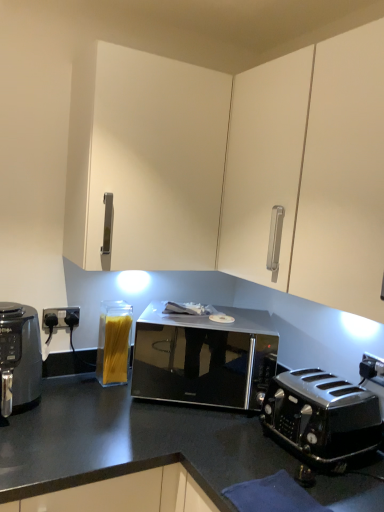
Measure the distance between polished black toaster at lower right and camera.

polished black toaster at lower right is 3.95 feet from camera.

The width and height of the screenshot is (384, 512). What are the coordinates of `black glossy microwave at center` in the screenshot? It's located at (204, 358).

This screenshot has height=512, width=384. What do you see at coordinates (19, 357) in the screenshot?
I see `black matte air fryer at left` at bounding box center [19, 357].

Where is `white matte cabinet at upper center`? This screenshot has width=384, height=512. white matte cabinet at upper center is located at coordinates (145, 160).

The height and width of the screenshot is (512, 384). What do you see at coordinates (114, 342) in the screenshot?
I see `clear glass container of spaghetti at lower left` at bounding box center [114, 342].

The width and height of the screenshot is (384, 512). Find the location of `polished black toaster at lower right`. polished black toaster at lower right is located at coordinates (322, 417).

How many degrees apart are the facing directions of black glossy microwave at center and black plastic electrical outlet at lower right?

56.8 degrees separate the facing orientations of black glossy microwave at center and black plastic electrical outlet at lower right.

From a real-world perspective, does black glossy microwave at center stand above black plastic electrical outlet at lower right?

Incorrect, from a real-world perspective, black glossy microwave at center is lower than black plastic electrical outlet at lower right.

From the image's perspective, is black glossy microwave at center on black plastic electrical outlet at lower right?

No.

Is black matte air fryer at left located outside black glossy microwave at center?

Yes, black matte air fryer at left is not within black glossy microwave at center.

Is point (31, 364) positioned behind point (154, 348)?

That is False.

Locate an element on the screen. microwave oven on the right of black matte air fryer at left is located at coordinates (204, 358).

From the picture: From the image's perspective, which is above, black matte air fryer at left or black glossy microwave at center?

black matte air fryer at left appears higher in the image.

Is polished black toaster at lower right taller than clear glass container of spaghetti at lower left?

In fact, polished black toaster at lower right may be shorter than clear glass container of spaghetti at lower left.

From the image's perspective, is polished black toaster at lower right located above clear glass container of spaghetti at lower left?

Actually, polished black toaster at lower right appears below clear glass container of spaghetti at lower left in the image.

Can you confirm if polished black toaster at lower right is bigger than clear glass container of spaghetti at lower left?

Indeed, polished black toaster at lower right has a larger size compared to clear glass container of spaghetti at lower left.

Is polished black toaster at lower right oriented away from clear glass container of spaghetti at lower left?

No, polished black toaster at lower right's orientation is not away from clear glass container of spaghetti at lower left.

Would you say clear glass container of spaghetti at lower left is inside or outside black glossy microwave at center?

The correct answer is: outside.

What's the angular difference between clear glass container of spaghetti at lower left and black glossy microwave at center's facing directions?

The facing directions of clear glass container of spaghetti at lower left and black glossy microwave at center are 24.8 degrees apart.

Does clear glass container of spaghetti at lower left have a larger size compared to black glossy microwave at center?

Incorrect, clear glass container of spaghetti at lower left is not larger than black glossy microwave at center.

Where is `microwave oven on the right of the clear glass container of spaghetti at lower left`? The image size is (384, 512). microwave oven on the right of the clear glass container of spaghetti at lower left is located at coordinates (204, 358).

Is polished black toaster at lower right to the left or to the right of black plastic electrical outlet at lower right in the image?

In the image, polished black toaster at lower right appears on the left side of black plastic electrical outlet at lower right.

From the image's perspective, which one is positioned higher, polished black toaster at lower right or black plastic electrical outlet at lower right?

black plastic electrical outlet at lower right appears higher in the image.

Is polished black toaster at lower right oriented away from black plastic electrical outlet at lower right?

No.

Considering the sizes of objects polished black toaster at lower right and black plastic electrical outlet at lower right in the image provided, who is smaller, polished black toaster at lower right or black plastic electrical outlet at lower right?

With smaller size is black plastic electrical outlet at lower right.

Does point (114, 334) appear closer or farther from the camera than point (275, 392)?

Point (114, 334) is farther from the camera than point (275, 392).

Could you tell me if clear glass container of spaghetti at lower left is turned towards polished black toaster at lower right?

No, clear glass container of spaghetti at lower left is not oriented towards polished black toaster at lower right.

How much distance is there between clear glass container of spaghetti at lower left and polished black toaster at lower right?

The distance of clear glass container of spaghetti at lower left from polished black toaster at lower right is 28.07 inches.

From the picture: Which of these two, clear glass container of spaghetti at lower left or polished black toaster at lower right, stands taller?

Standing taller between the two is clear glass container of spaghetti at lower left.

Is black glossy microwave at center outside of white matte cabinet at upper center?

black glossy microwave at center lies outside white matte cabinet at upper center's area.

Which object is closer to the camera, black glossy microwave at center or white matte cabinet at upper center?

white matte cabinet at upper center is more forward.

Identify the location of cabinetry that is above the black glossy microwave at center (from a real-world perspective). (145, 160).

Can you tell me how much black glossy microwave at center and white matte cabinet at upper center differ in facing direction?

They differ by 34 degrees in their facing directions.

Find the location of a particular element. electric outlet located in front of the black glossy microwave at center is located at coordinates (372, 368).

Locate an element on the screen. microwave oven that is behind the black matte air fryer at left is located at coordinates (204, 358).

Which object lies further to the anchor point black plastic electrical outlet at lower right, white matte cabinet at upper center or black glossy microwave at center?

white matte cabinet at upper center.

Considering their positions, is black glossy microwave at center positioned closer to black plastic electrical outlet at lower right than clear glass container of spaghetti at lower left?

black glossy microwave at center is positioned closer to the anchor black plastic electrical outlet at lower right.

From the image, which object appears to be nearer to polished black toaster at lower right, black plastic electrical outlet at lower right or clear glass container of spaghetti at lower left?

Among the two, black plastic electrical outlet at lower right is located nearer to polished black toaster at lower right.

From the image, which object appears to be farther from clear glass container of spaghetti at lower left, black matte air fryer at left or white matte cabinet at upper center?

The object further to clear glass container of spaghetti at lower left is white matte cabinet at upper center.

Based on their spatial positions, is clear glass container of spaghetti at lower left or black glossy microwave at center further from polished black toaster at lower right?

clear glass container of spaghetti at lower left is positioned further to the anchor polished black toaster at lower right.

From the image, which object appears to be nearer to polished black toaster at lower right, black matte air fryer at left or white matte cabinet at upper center?

white matte cabinet at upper center lies closer to polished black toaster at lower right than the other object.

Which object lies nearer to the anchor point black plastic electrical outlet at lower right, polished black toaster at lower right or black matte air fryer at left?

Based on the image, polished black toaster at lower right appears to be nearer to black plastic electrical outlet at lower right.

Looking at the image, which one is located closer to black plastic electrical outlet at lower right, clear glass container of spaghetti at lower left or polished black toaster at lower right?

The object closer to black plastic electrical outlet at lower right is polished black toaster at lower right.

You are a GUI agent. You are given a task and a screenshot of the screen. Output one action in this format:
    pyautogui.click(x=<x>, y=<y>)
    Task: Click on the home appliance that lies between white matte cabinet at upper center and clear glass container of spaghetti at lower left from top to bottom
    
    Given the screenshot: What is the action you would take?
    tap(19, 357)

The width and height of the screenshot is (384, 512). Identify the location of electric outlet between white matte cabinet at upper center and polished black toaster at lower right vertically. (372, 368).

At what (x,y) coordinates should I click in order to perform the action: click on appliance between white matte cabinet at upper center and polished black toaster at lower right from top to bottom. Please return your answer as a coordinate pair (x, y). Looking at the image, I should click on (114, 342).

Image resolution: width=384 pixels, height=512 pixels. Identify the location of cabinetry located between clear glass container of spaghetti at lower left and black plastic electrical outlet at lower right in the left-right direction. (145, 160).